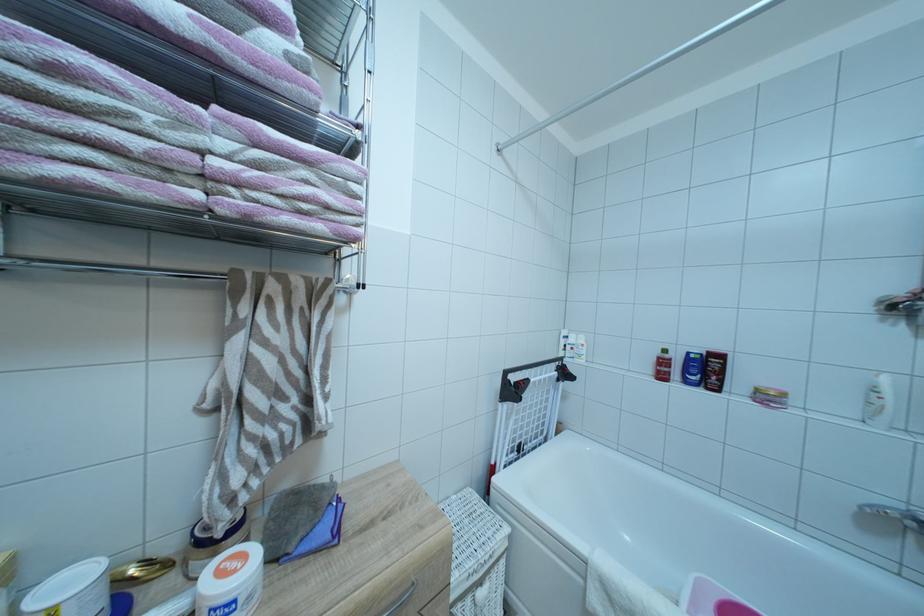
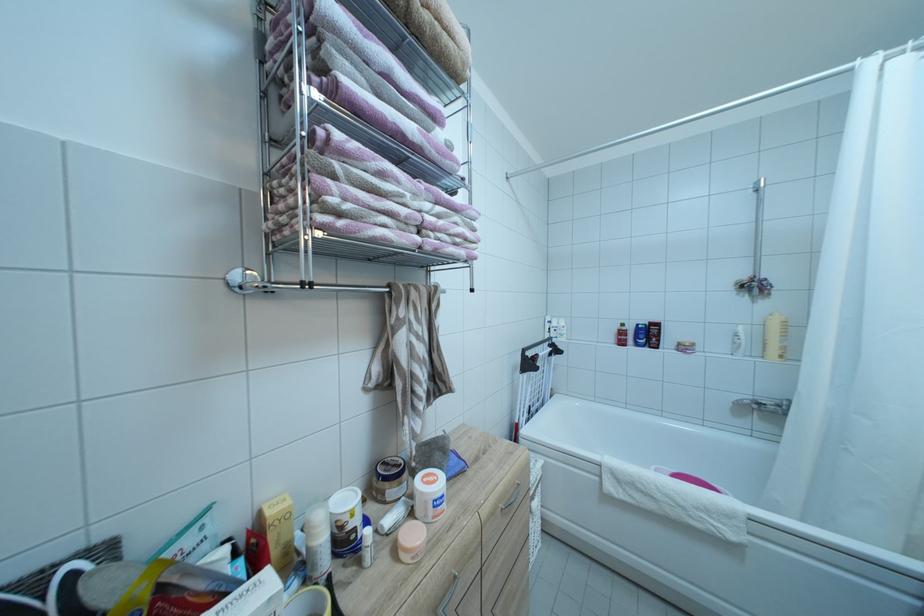
In a continuous first-person perspective shot, in which direction is the camera moving?

The movement direction of the cameraman is left, backward.